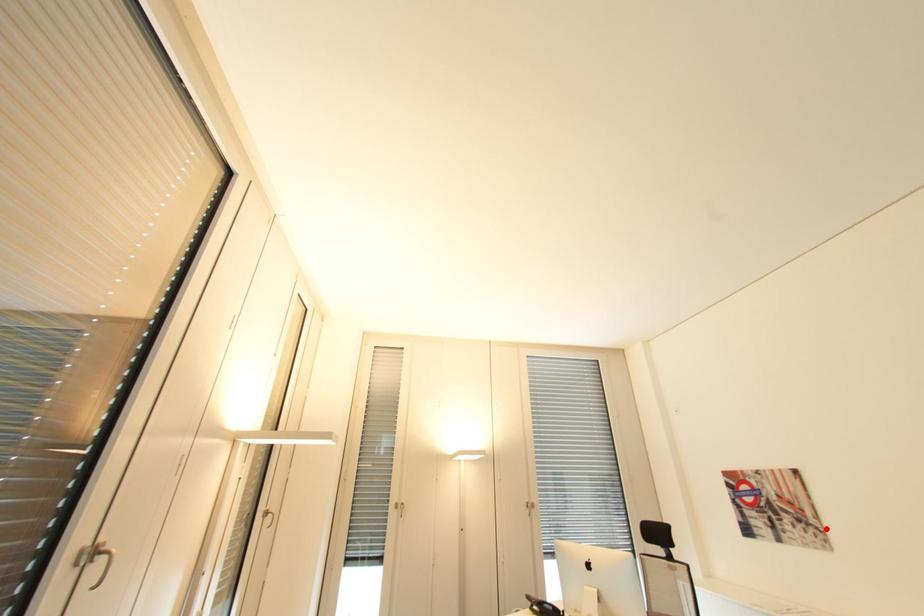
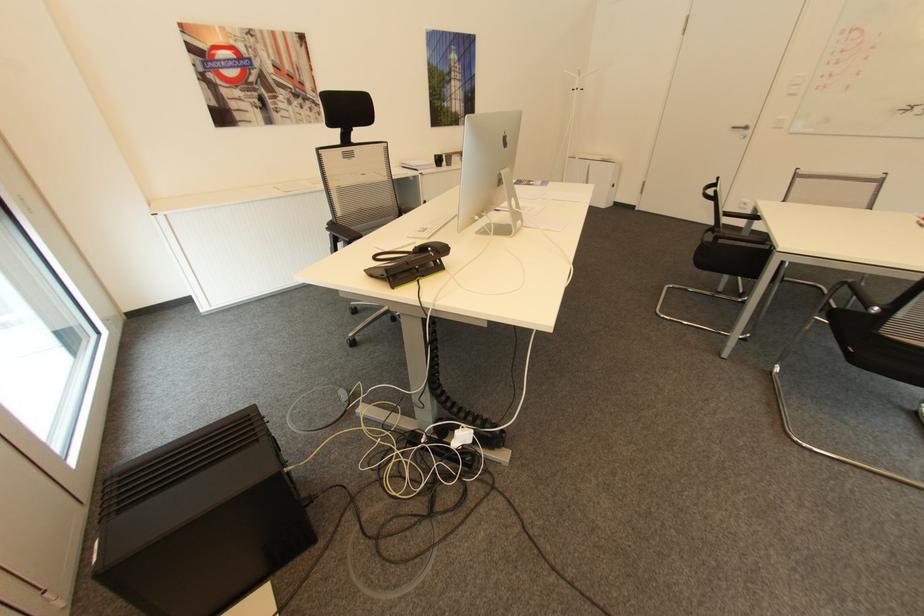
The point at the highlighted location is marked in the first image. Where is the corresponding point in the second image?

(322, 102)